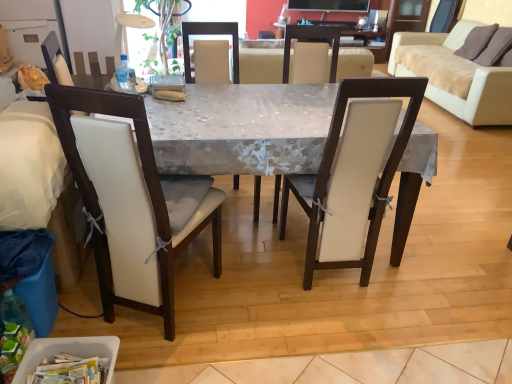
The image size is (512, 384). In order to click on empty space that is in between white leather chair at left, which is the 1th chair in left-to-right order, and matte white table at center in this screenshot , I will do `click(252, 313)`.